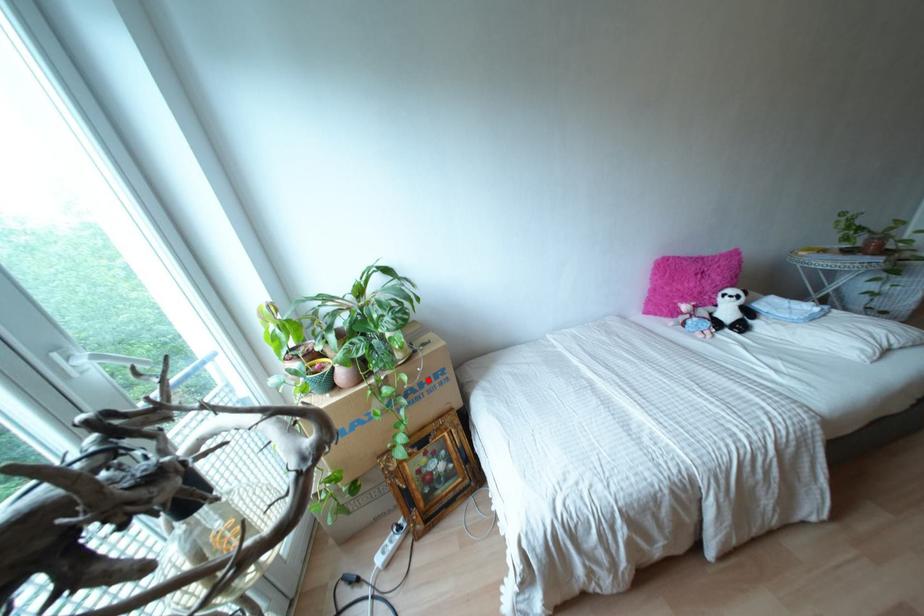
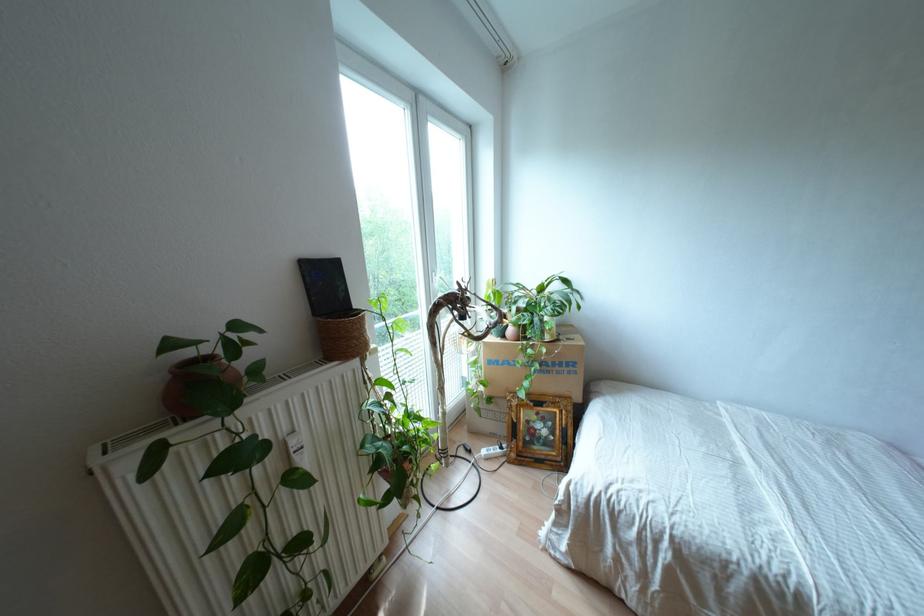
Where in the second image is the point corresponding to the highlighted location from the first image?

(560, 363)